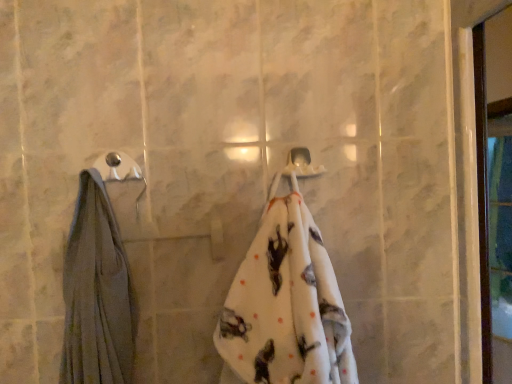
This screenshot has height=384, width=512. What do you see at coordinates (285, 305) in the screenshot?
I see `white fleece towel at center` at bounding box center [285, 305].

Identify the location of white fleece towel at center. This screenshot has height=384, width=512. (285, 305).

The image size is (512, 384). In order to click on white fleece towel at center in this screenshot , I will do [285, 305].